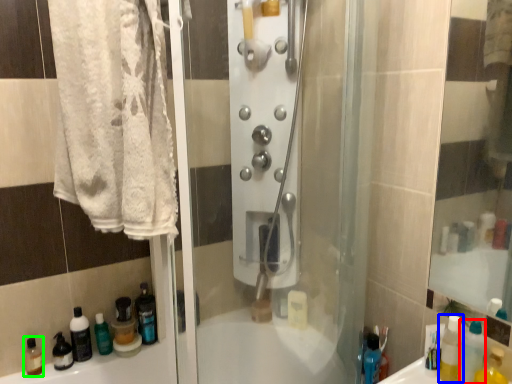
Question: Estimate the real-world distances between objects in this image. Which object is farther from bottle (highlighted by a red box), mouthwash (highlighted by a blue box) or mouthwash (highlighted by a green box)?

Choices:
 (A) mouthwash
 (B) mouthwash

Answer: (B)